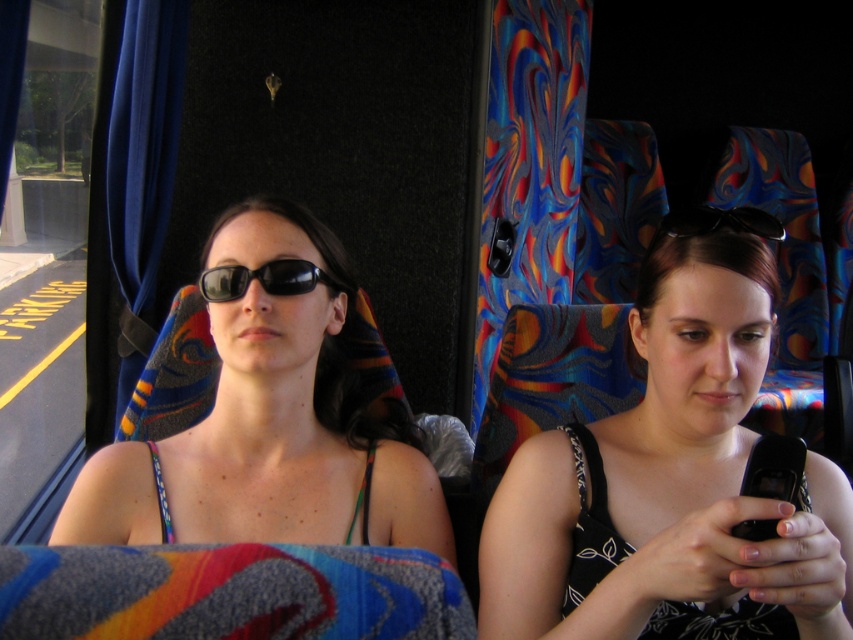
Question: Which object appears closest to the camera in this image?

Choices:
 (A) black matte sunglasses at center
 (B) black plastic sunglasses at upper center
 (C) black fabric phone at center
 (D) matte black sunglasses at center

Answer: (C)

Question: Which of the following is the farthest from the observer?

Choices:
 (A) matte black sunglasses at center
 (B) black matte sunglasses at center
 (C) black plastic sunglasses at upper center

Answer: (B)

Question: From the image, what is the correct spatial relationship of matte black sunglasses at center in relation to black matte sunglasses at center?

Choices:
 (A) left
 (B) right

Answer: (A)

Question: Does matte black sunglasses at center appear on the left side of black matte sunglasses at center?

Choices:
 (A) yes
 (B) no

Answer: (A)

Question: Which point is farther from the camera taking this photo?

Choices:
 (A) (297, 275)
 (B) (664, 227)

Answer: (A)

Question: Is black matte sunglasses at center thinner than black plastic sunglasses at upper center?

Choices:
 (A) yes
 (B) no

Answer: (B)